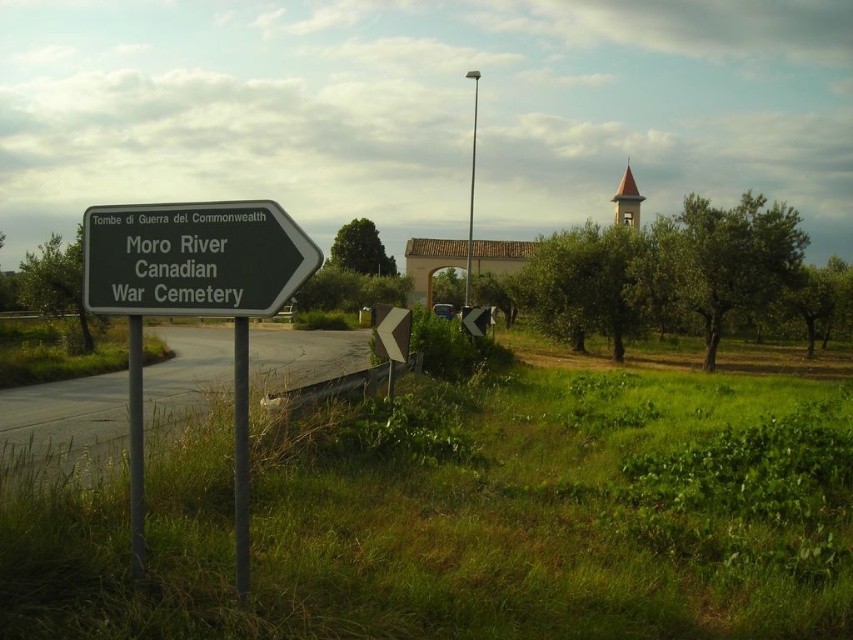
Is green metallic sign at left in front of black metal sign at left?

No, it is not.

Does point (175, 298) come behind point (102, 307)?

No, it is in front of (102, 307).

Find the location of a particular element. green metallic sign at left is located at coordinates (193, 304).